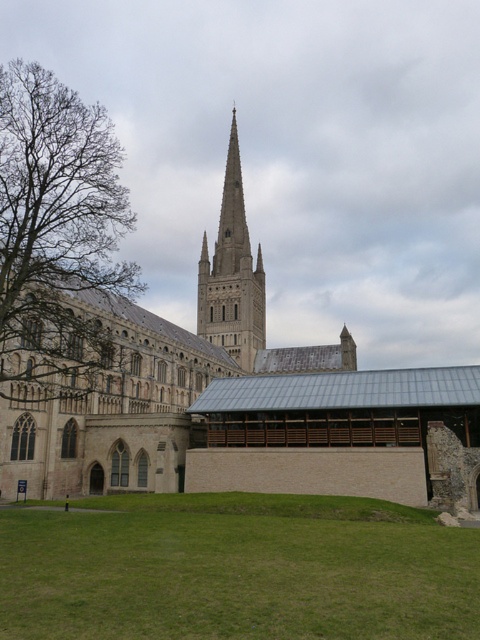
Question: Which object is closer to the camera taking this photo?

Choices:
 (A) brown leafy tree at left
 (B) green grass at lower center

Answer: (B)

Question: Is brown leafy tree at left positioned behind stone spire at center?

Choices:
 (A) yes
 (B) no

Answer: (B)

Question: Based on their relative distances, which object is farther from the beige stone church at center?

Choices:
 (A) green grass at lower center
 (B) stone spire at center
 (C) brown leafy tree at left

Answer: (A)

Question: Estimate the real-world distances between objects in this image. Which object is closer to the beige stone church at center?

Choices:
 (A) brown leafy tree at left
 (B) green grass at lower center
 (C) stone spire at center

Answer: (C)

Question: Does green grass at lower center appear on the left side of stone spire at center?

Choices:
 (A) no
 (B) yes

Answer: (B)

Question: Does brown leafy tree at left appear on the left side of stone spire at center?

Choices:
 (A) yes
 (B) no

Answer: (A)